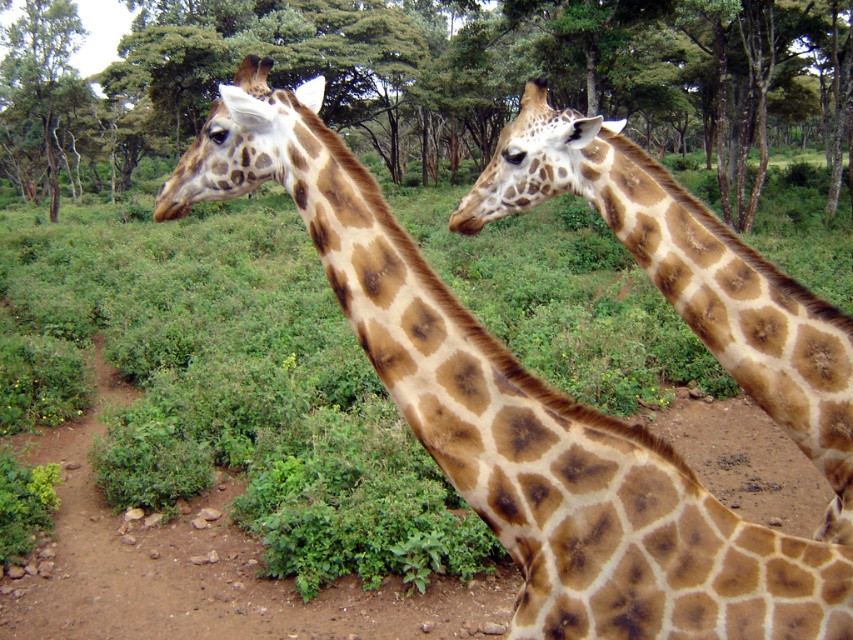
You are a photographer trying to capture a photo of the spotted brown giraffe at center. There is a green leafy tree at center in the way. Can you see the entire giraffe in your photo without any obstruction?

The green leafy tree at center is taller than the spotted brown giraffe at center, so the tree might block part of the giraffe in the photo.

You are a photographer planning to take a photo of the two giraffes. You want to ensure both the green leafy tree at center and the brown dirt track at center are visible in the frame. Since the giraffes are between you and these objects, which object will appear closer to the camera in your photo?

The green leafy tree at center appears closer to the camera because it is taller than the brown dirt track at center, making it more prominent in the foreground.

You are a park ranger observing two giraffes in the savanna. You notice a point marked at coordinates (440, 77). What object is located at that specific coordinate?

The green leafy tree at center is located at point (440, 77).